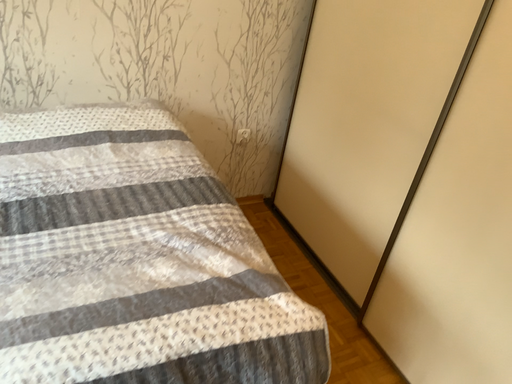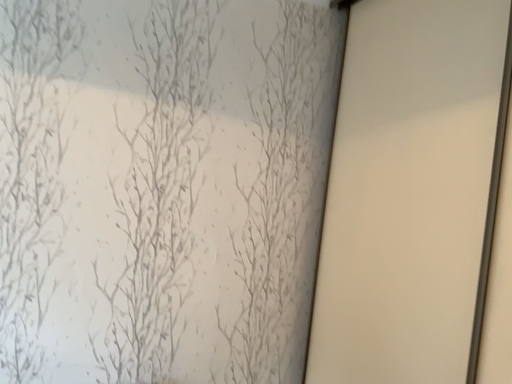
Question: How did the camera likely rotate when shooting the video?

Choices:
 (A) rotated downward
 (B) rotated upward

Answer: (B)